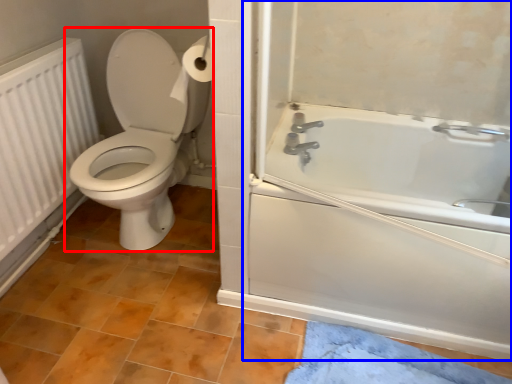
Question: Which of the following is the farthest to the observer, toilet (highlighted by a red box) or screen door (highlighted by a blue box)?

Choices:
 (A) toilet
 (B) screen door

Answer: (A)